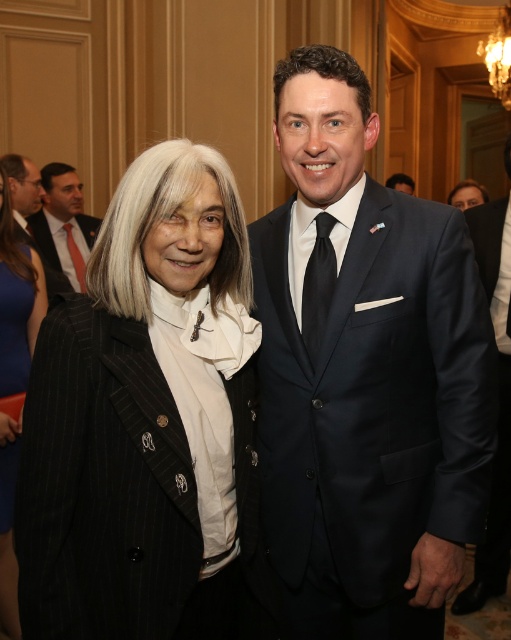
You are a photographer trying to capture a closeup shot of the matte black suit at upper left and the orange silk tie at left. The camera you are using has a minimum focus distance of 6 inches. Can you adjust your position to get both items in focus without moving the subjects?

The distance between the matte black suit at upper left and orange silk tie at left is 6.61 inches. Since the camera can focus as close as 6 inches, you can move closer to the subjects so that the 6.61 inch gap becomes within the 6 inch minimum focus distance, allowing both items to be in focus.